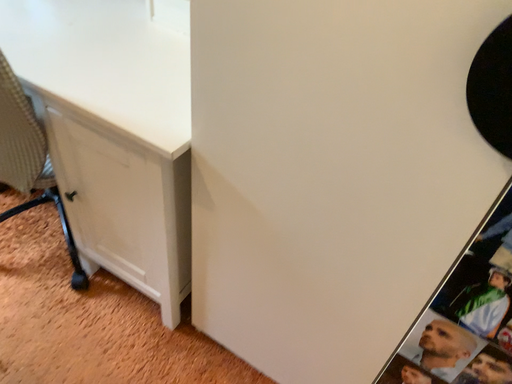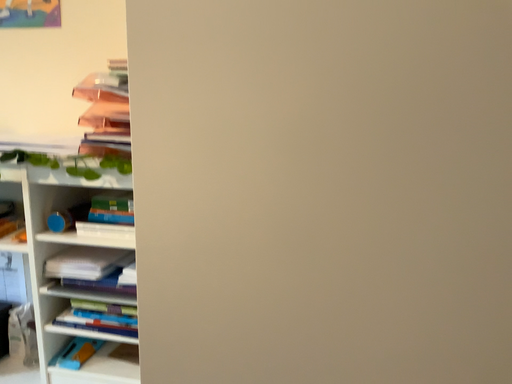
Question: Which way did the camera rotate in the video?

Choices:
 (A) rotated downward
 (B) rotated upward

Answer: (B)